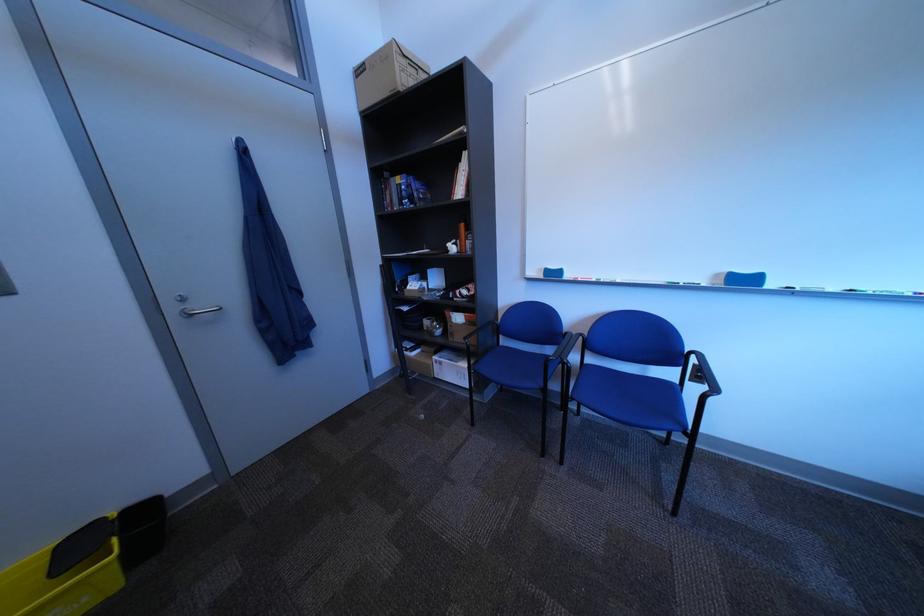
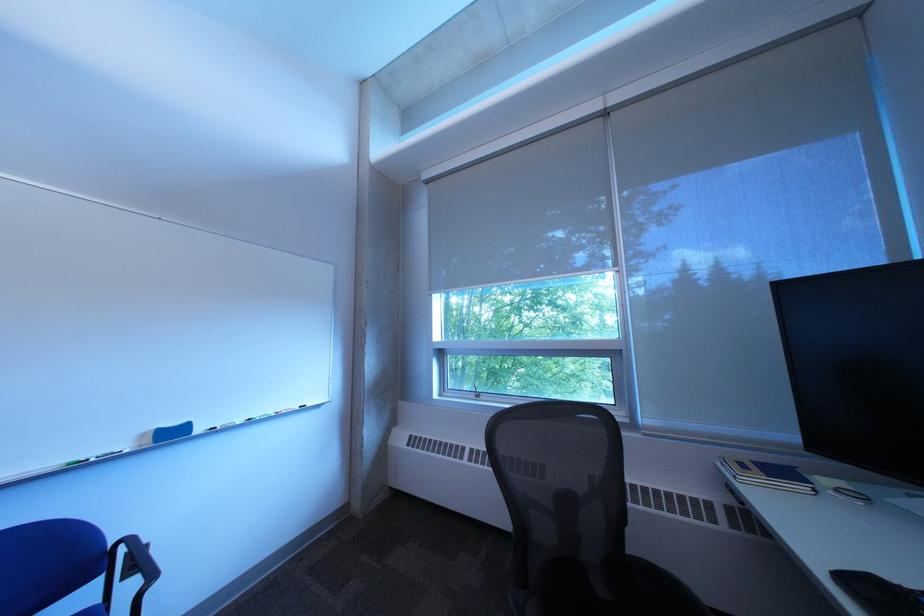
Where in the second image is the point corresponding to (x=733, y=277) from the first image?

(159, 437)